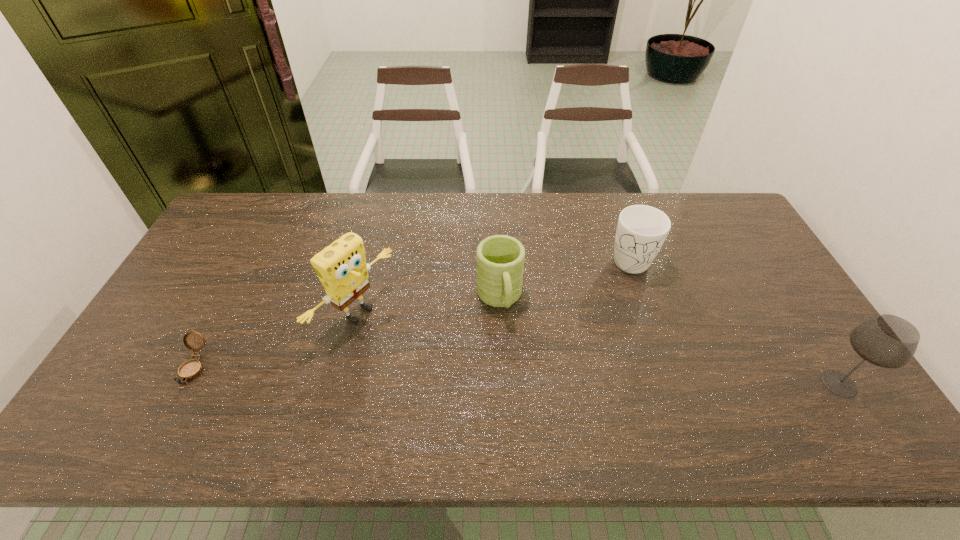
Where is `free spot between the leftmost object and the second object from right to left`? The width and height of the screenshot is (960, 540). free spot between the leftmost object and the second object from right to left is located at coordinates (413, 313).

Identify the location of free area in between the second object from left to right and the third object from left to right. This screenshot has width=960, height=540. (428, 306).

I want to click on vacant area that lies between the right mug and the left mug, so click(565, 279).

Identify the location of free area in between the rightmost object and the left mug. The height and width of the screenshot is (540, 960). (669, 341).

Locate an element on the screen. This screenshot has width=960, height=540. vacant space in between the right mug and the left mug is located at coordinates (565, 279).

Locate an element on the screen. The image size is (960, 540). empty location between the left mug and the compass is located at coordinates (347, 333).

Where is `object that is the second closest to the sponge`? Image resolution: width=960 pixels, height=540 pixels. object that is the second closest to the sponge is located at coordinates (191, 369).

You are a GUI agent. You are given a task and a screenshot of the screen. Output one action in this format:
    pyautogui.click(x=<x>, y=<y>)
    Task: Click on the object that is the fourth closest to the fourth object from left to right
    
    Given the screenshot: What is the action you would take?
    pyautogui.click(x=191, y=369)

Image resolution: width=960 pixels, height=540 pixels. I want to click on blank space that satisfies the following two spatial constraints: 1. on the face of the compass; 2. on the left side of the rightmost object, so click(x=185, y=384).

The width and height of the screenshot is (960, 540). In order to click on free space that satisfies the following two spatial constraints: 1. on the face of the rightmost object; 2. on the left side of the shortest object in this screenshot , I will do `click(185, 384)`.